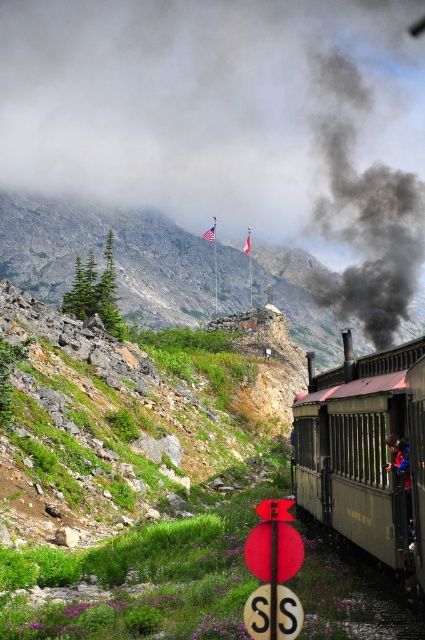
You are a photographer planning to take a picture of the rugged stone mountain at upper center and the matte black train at right. Which object should you focus on first if you want to capture both in the same frame without moving the camera?

The rugged stone mountain at upper center is bigger than the matte black train at right, so you should focus on the rugged stone mountain at upper center first to ensure it stands out prominently in the frame.

You are a photographer planning to take a photo of the rugged stone mountain at upper center and the matte black train at right. Based on their sizes in the image, which object should appear larger in your photo?

The rugged stone mountain at upper center is much taller than the matte black train at right, so it should appear larger in the photo.